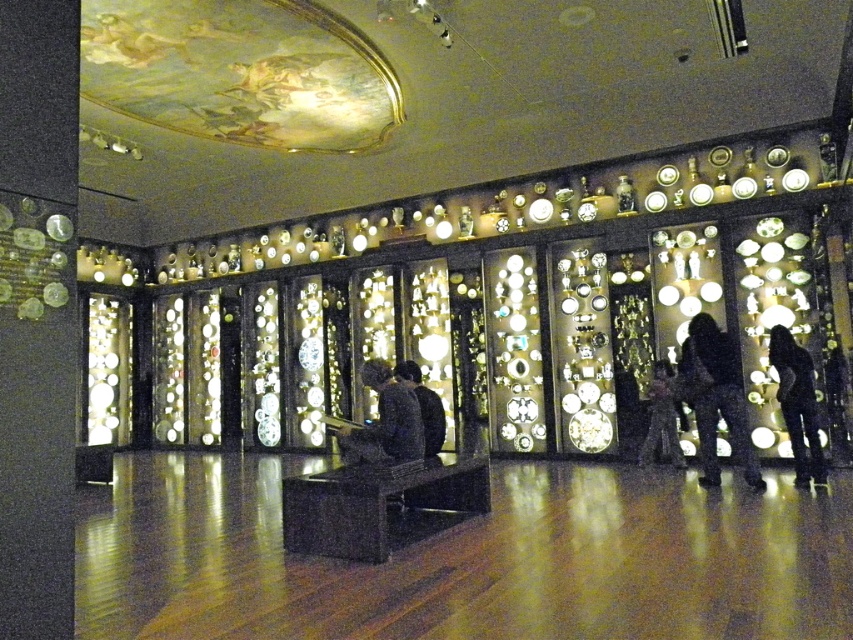
Question: Which object is positioned farthest from the black fabric at center?

Choices:
 (A) black matte figure at lower right
 (B) silvery metallic dress at center
 (C) black matte clothing at center
 (D) dark brown leather jacket at center

Answer: (A)

Question: Is silvery metallic dress at center in front of black fabric at center?

Choices:
 (A) yes
 (B) no

Answer: (B)

Question: Which point is farther to the camera?

Choices:
 (A) (822, 460)
 (B) (660, 371)
 (C) (349, 440)

Answer: (B)

Question: Which point is farther to the camera?

Choices:
 (A) black matte clothing at center
 (B) black fabric at center

Answer: (A)

Question: Is the position of black matte clothing at center less distant than that of dark brown leather jacket at center?

Choices:
 (A) yes
 (B) no

Answer: (B)

Question: Does dark brown leather jacket at center have a lesser width compared to black fabric at center?

Choices:
 (A) yes
 (B) no

Answer: (B)